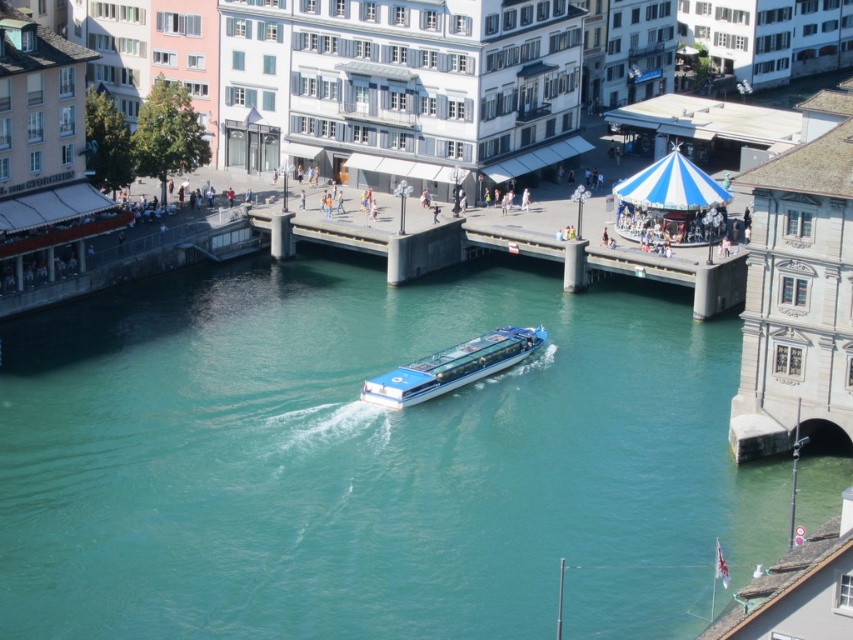
Who is positioned more to the left, teal glossy water at center or blue glossy boat at center?

Positioned to the left is teal glossy water at center.

Who is shorter, teal glossy water at center or blue glossy boat at center?

blue glossy boat at center is shorter.

Which is behind, point (326, 556) or point (404, 404)?

Point (404, 404)

The height and width of the screenshot is (640, 853). Find the location of `teal glossy water at center`. teal glossy water at center is located at coordinates (369, 460).